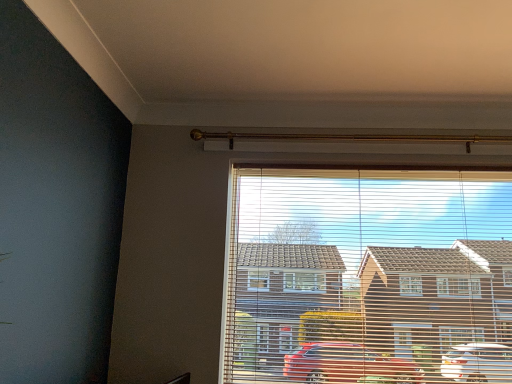
Describe the element at coordinates (368, 275) in the screenshot. This screenshot has height=384, width=512. I see `wooden blinds at center` at that location.

Where is `wooden blinds at center`? The image size is (512, 384). wooden blinds at center is located at coordinates (368, 275).

This screenshot has height=384, width=512. I want to click on wooden blinds at center, so click(368, 275).